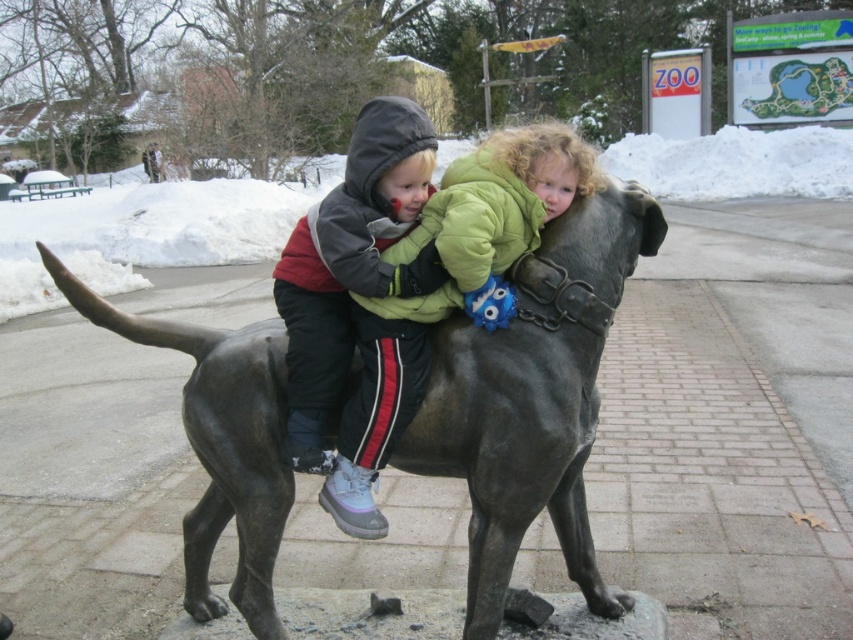
You are a photographer trying to capture the children and the dog statue in a winter scene. You notice a point at coordinates point (144, 232). Where is this point located relative to the white fluffy snow at upper center?

The point (144, 232) is located on the white fluffy snow at upper center.

You are a photographer trying to capture both the green fleece jacket at center and the matte black jacket at center in a single frame. Since the camera has a limited focus range, which jacket should you prioritize to ensure it stays in focus if you can only focus on one?

The green fleece jacket at center is bigger than the matte black jacket at center, so you should prioritize focusing on the green fleece jacket at center to ensure it stays in focus.

You are a photographer standing at the base of the statue. You want to take a photo that includes both the white fluffy snow at upper center and the green fleece jacket at center. Given that your camera has a maximum focus range of 10 meters, will you be able to capture both subjects in focus?

The white fluffy snow at upper center is 14.41 meters away from the green fleece jacket at center. Since the camera can only focus up to 10 meters, the distance between them exceeds the camera range. Therefore, you cannot capture both in focus.